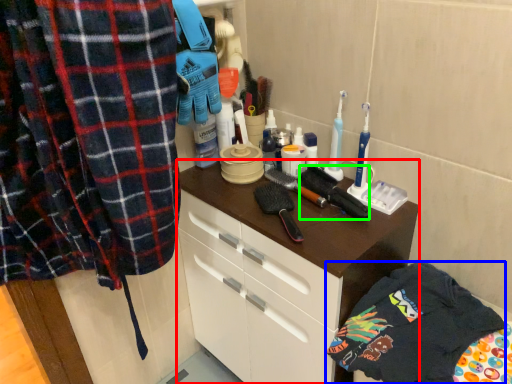
Question: Estimate the real-world distances between objects in this image. Which object is farther from cabinetry (highlighted by a red box), clothing (highlighted by a blue box) or brush (highlighted by a green box)?

Choices:
 (A) clothing
 (B) brush

Answer: (B)